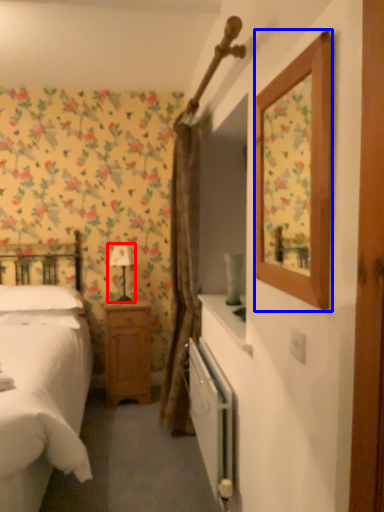
Question: Which object is further to the camera taking this photo, table lamp (highlighted by a red box) or picture frame (highlighted by a blue box)?

Choices:
 (A) table lamp
 (B) picture frame

Answer: (A)